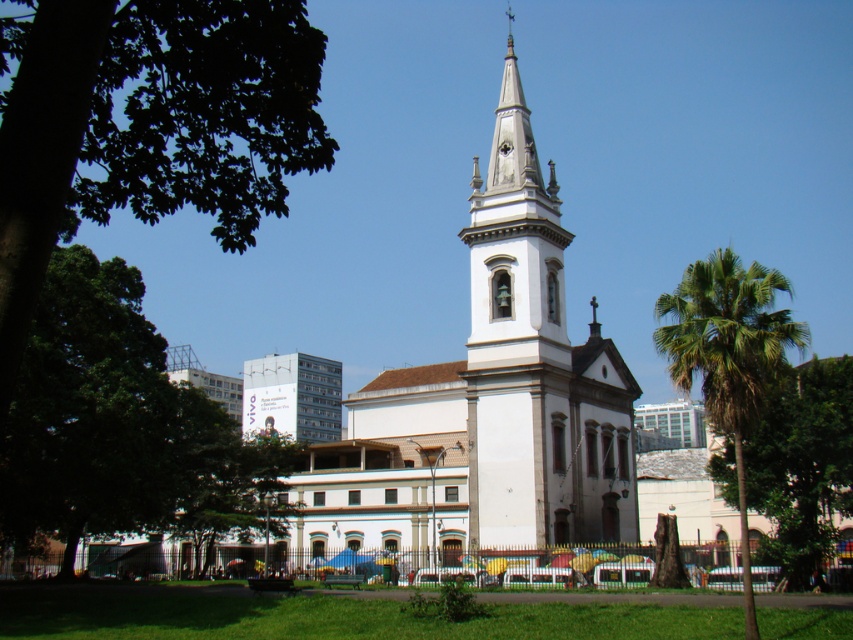
You are standing at the point with coordinates point [779,323] and want to walk towards the church steeple. Is the point point [329,481] located behind you or in front of you relative to your direction of movement?

The point [329,481] is behind point [779,323], so when you walk towards the church steeple from point [779,323], the point [329,481] will be behind you.

You are a city planner reviewing the park layout. You need to determine if the green leafy tree at center can be moved closer to the street without blocking the view of the white stone bell tower at center. Based on their sizes, what would you advise?

The white stone bell tower at center is larger in size than the green leafy tree at center. Moving the green leafy tree at center closer to the street might not block the view of the white stone bell tower at center since the tree is smaller and may not obstruct the taller structure.

You are standing in the park and want to take a photo of both the white stone church at center and the green leafy palm tree at right. To ensure both are in the frame, should you position yourself to the left or right of the palm tree?

You should position yourself to the left of the green leafy palm tree at right because the white stone church at center is on the left side of the palm tree, so standing to the left of the palm tree will keep both in the frame.